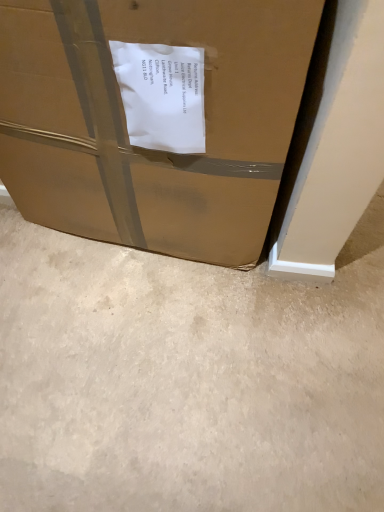
What is the approximate height of brown cardboard box at lower left?

30.10 inches.

What do you see at coordinates (126, 126) in the screenshot? I see `brown cardboard box at lower left` at bounding box center [126, 126].

The image size is (384, 512). Identify the location of brown cardboard box at lower left. (126, 126).

What do you see at coordinates (187, 379) in the screenshot? I see `beige carpet at lower center` at bounding box center [187, 379].

Locate an element on the screen. beige carpet at lower center is located at coordinates click(187, 379).

Find the location of a particular element. Image resolution: width=384 pixels, height=512 pixels. brown cardboard box at lower left is located at coordinates (126, 126).

Between beige carpet at lower center and brown cardboard box at lower left, which one appears on the right side from the viewer's perspective?

beige carpet at lower center.

Does beige carpet at lower center come in front of brown cardboard box at lower left?

That is False.

From the picture: Which is less distant, (262, 332) or (64, 204)?

Point (64, 204)

From the image's perspective, is beige carpet at lower center below brown cardboard box at lower left?

Yes, from the image's perspective, beige carpet at lower center is beneath brown cardboard box at lower left.

From a real-world perspective, is beige carpet at lower center on top of brown cardboard box at lower left?

No, from a real-world perspective, beige carpet at lower center is not over brown cardboard box at lower left

Considering the relative sizes of beige carpet at lower center and brown cardboard box at lower left in the image provided, is beige carpet at lower center wider than brown cardboard box at lower left?

Indeed, beige carpet at lower center has a greater width compared to brown cardboard box at lower left.

From the picture: From their relative heights in the image, would you say beige carpet at lower center is taller or shorter than brown cardboard box at lower left?

In the image, beige carpet at lower center appears to be shorter than brown cardboard box at lower left.

Can you confirm if beige carpet at lower center is bigger than brown cardboard box at lower left?

No, beige carpet at lower center is not bigger than brown cardboard box at lower left.

Would you say beige carpet at lower center is inside or outside brown cardboard box at lower left?

beige carpet at lower center lies outside brown cardboard box at lower left.

Is beige carpet at lower center with brown cardboard box at lower left?

No, beige carpet at lower center is not with brown cardboard box at lower left.

Is beige carpet at lower center positioned with its back to brown cardboard box at lower left?

That's not correct — beige carpet at lower center is not looking away from brown cardboard box at lower left.

How far apart are beige carpet at lower center and brown cardboard box at lower left?

14.43 inches.

You are a GUI agent. You are given a task and a screenshot of the screen. Output one action in this format:
    pyautogui.click(x=<x>, y=<y>)
    Task: Click on the box that appears above the beige carpet at lower center (from the image's perspective)
    
    Given the screenshot: What is the action you would take?
    pyautogui.click(x=126, y=126)

Looking at this image, based on their positions, is brown cardboard box at lower left located to the left or right of beige carpet at lower center?

brown cardboard box at lower left is positioned on beige carpet at lower center's left side.

Which object is further away from the camera taking this photo, brown cardboard box at lower left or beige carpet at lower center?

beige carpet at lower center.

Is point (315, 18) closer or farther from the camera than point (171, 296)?

Point (315, 18) is positioned closer to the camera compared to point (171, 296).

From the image's perspective, is brown cardboard box at lower left on top of beige carpet at lower center?

Yes.

From a real-world perspective, is brown cardboard box at lower left over beige carpet at lower center?

Yes, from a real-world perspective, brown cardboard box at lower left is over beige carpet at lower center

Does brown cardboard box at lower left have a lesser width compared to beige carpet at lower center?

Yes, brown cardboard box at lower left is thinner than beige carpet at lower center.

Considering the sizes of objects brown cardboard box at lower left and beige carpet at lower center in the image provided, who is shorter, brown cardboard box at lower left or beige carpet at lower center?

With less height is beige carpet at lower center.

Who is smaller, brown cardboard box at lower left or beige carpet at lower center?

beige carpet at lower center is smaller.

Can beige carpet at lower center be found inside brown cardboard box at lower left?

No, beige carpet at lower center is not inside brown cardboard box at lower left.

Are brown cardboard box at lower left and beige carpet at lower center making contact?

There is a gap between brown cardboard box at lower left and beige carpet at lower center.

Could you tell me if brown cardboard box at lower left is turned towards beige carpet at lower center?

Yes, brown cardboard box at lower left is oriented towards beige carpet at lower center.

Measure the distance from brown cardboard box at lower left to beige carpet at lower center.

brown cardboard box at lower left is 14.43 inches from beige carpet at lower center.

Where is `concrete on the right of brown cardboard box at lower left`? The image size is (384, 512). concrete on the right of brown cardboard box at lower left is located at coordinates tap(187, 379).

Find the location of a particular element. box located in front of the beige carpet at lower center is located at coordinates (126, 126).

The height and width of the screenshot is (512, 384). I want to click on concrete on the right of brown cardboard box at lower left, so click(x=187, y=379).